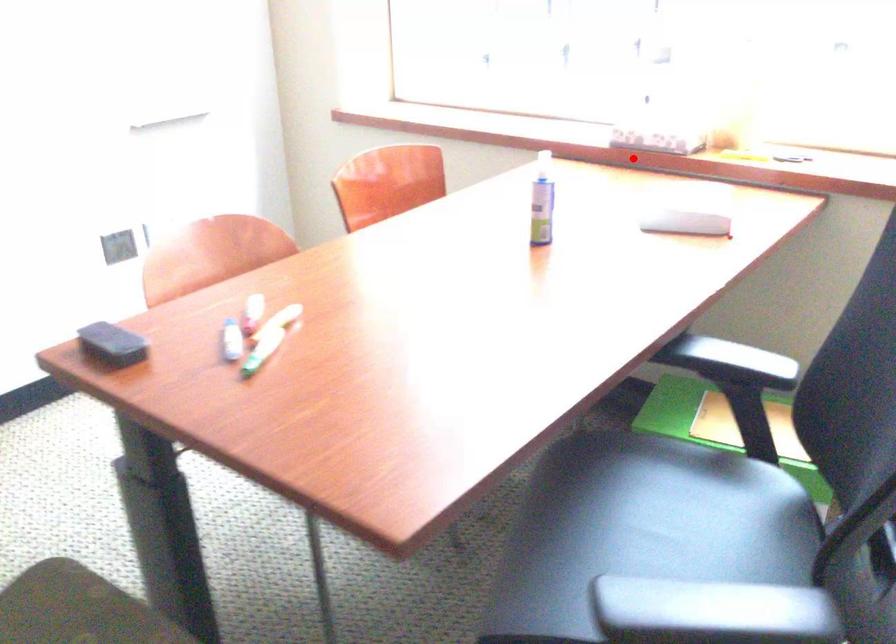
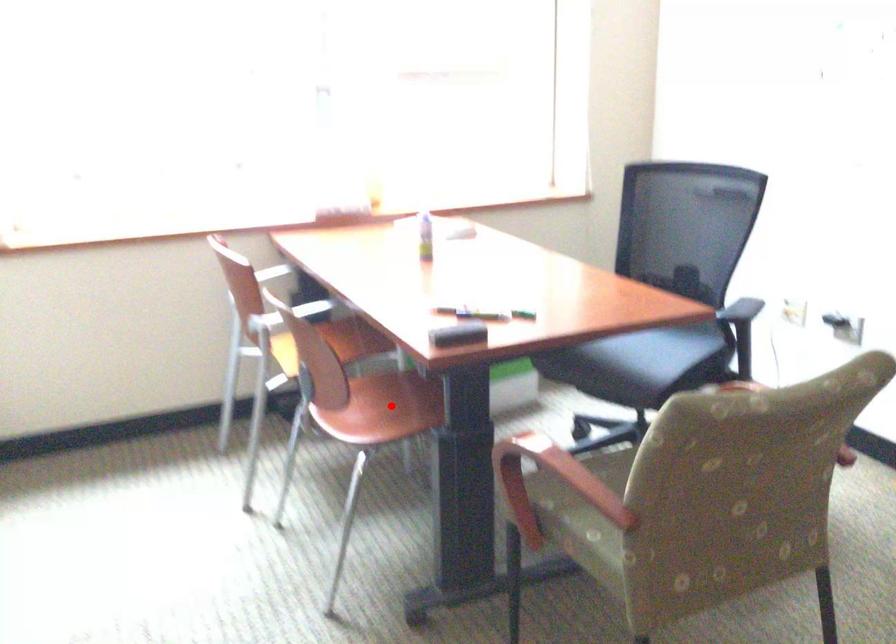
I am providing you with two images of the same scene from different viewpoints. A red point is marked on the first image and another point is marked on the second image. Is the marked point in image1 the same physical position as the marked point in image2?

No